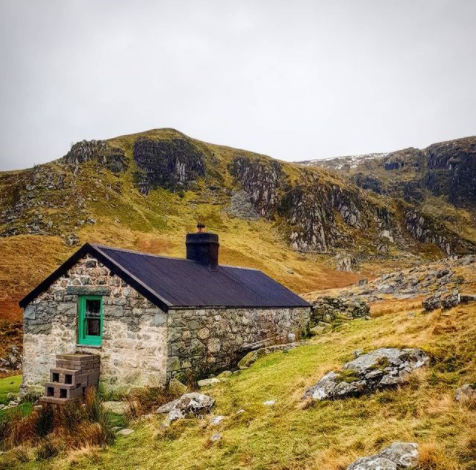
You are a GUI agent. You are given a task and a screenshot of the screen. Output one action in this format:
    pyautogui.click(x=<x>, y=<y>)
    Task: Click on the window
    
    Given the screenshot: What is the action you would take?
    pyautogui.click(x=95, y=307), pyautogui.click(x=93, y=325)